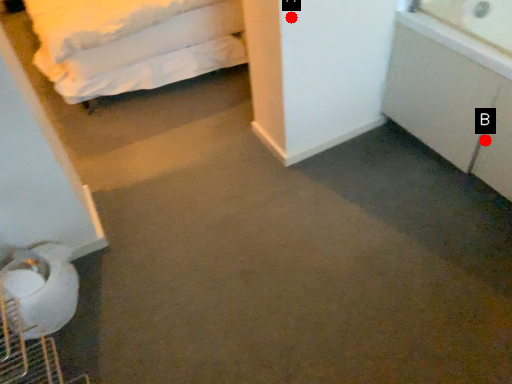
Question: Two points are circled on the image, labeled by A and B beside each circle. Which point is closer to the camera?

Choices:
 (A) A is closer
 (B) B is closer

Answer: (A)